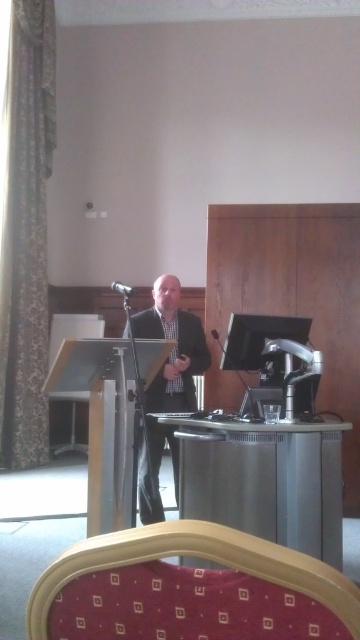
The image size is (360, 640). Describe the element at coordinates (173, 348) in the screenshot. I see `dark suit at center` at that location.

Does dark suit at center appear over black metallic microphone at center?

No.

Where is `dark suit at center`? The width and height of the screenshot is (360, 640). dark suit at center is located at coordinates (173, 348).

Where is `dark suit at center`? The height and width of the screenshot is (640, 360). dark suit at center is located at coordinates (173, 348).

Can you confirm if dark suit at center is positioned below black matte microphone at center?

Correct, dark suit at center is located below black matte microphone at center.

In the scene shown: Which is more to the right, dark suit at center or black matte microphone at center?

Positioned to the right is dark suit at center.

At what (x,y) coordinates should I click in order to perform the action: click on dark suit at center. Please return your answer as a coordinate pair (x, y). Image resolution: width=360 pixels, height=640 pixels. Looking at the image, I should click on (173, 348).

Find the location of `dark suit at center`. dark suit at center is located at coordinates [173, 348].

Looking at this image, can you confirm if satin silver podium at center is positioned to the left of black metallic microphone at center?

No, satin silver podium at center is not to the left of black metallic microphone at center.

Can you confirm if satin silver podium at center is taller than black metallic microphone at center?

Indeed, satin silver podium at center has a greater height compared to black metallic microphone at center.

Is point (335, 472) in front of point (216, 337)?

Yes, it is in front of point (216, 337).

This screenshot has height=640, width=360. What are the coordinates of `satin silver podium at center` in the screenshot? It's located at (264, 480).